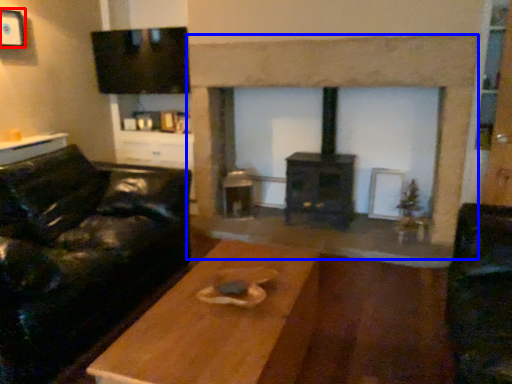
Question: Which object is closer to the camera taking this photo, picture frame (highlighted by a red box) or fireplace (highlighted by a blue box)?

Choices:
 (A) picture frame
 (B) fireplace

Answer: (B)